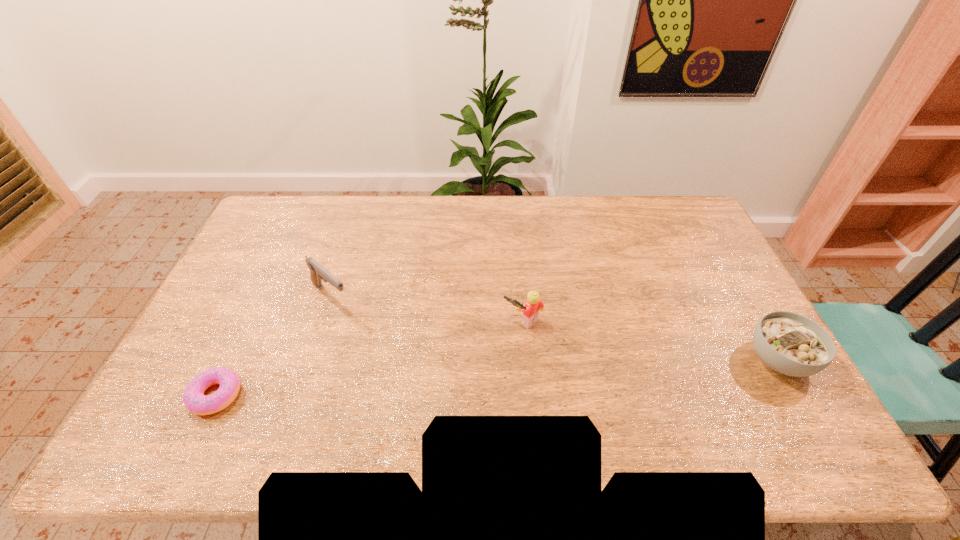
Locate an element on the screen. The image size is (960, 540). free space located at the barrel of the pistol is located at coordinates (411, 363).

Identify the location of free space located at the barrel of the pistol. (416, 367).

The image size is (960, 540). Find the location of `vacant region located 0.220m in front of the third nearest object with the accessory visible`. vacant region located 0.220m in front of the third nearest object with the accessory visible is located at coordinates (455, 375).

Identify the location of free location located 0.290m in front of the third nearest object with the accessory visible. The height and width of the screenshot is (540, 960). (436, 393).

Locate an element on the screen. This screenshot has width=960, height=540. vacant space located 0.340m in front of the third nearest object with the accessory visible is located at coordinates (420, 406).

Identify the location of doughnut situated at the near edge. Image resolution: width=960 pixels, height=540 pixels. (194, 399).

Image resolution: width=960 pixels, height=540 pixels. I want to click on soup bowl that is positioned at the near edge, so click(x=789, y=343).

The image size is (960, 540). In order to click on object positioned at the left edge in this screenshot , I will do `click(194, 399)`.

In order to click on object that is positioned at the right edge in this screenshot , I will do `click(789, 343)`.

Find the location of `object at the near left corner`. object at the near left corner is located at coordinates (194, 399).